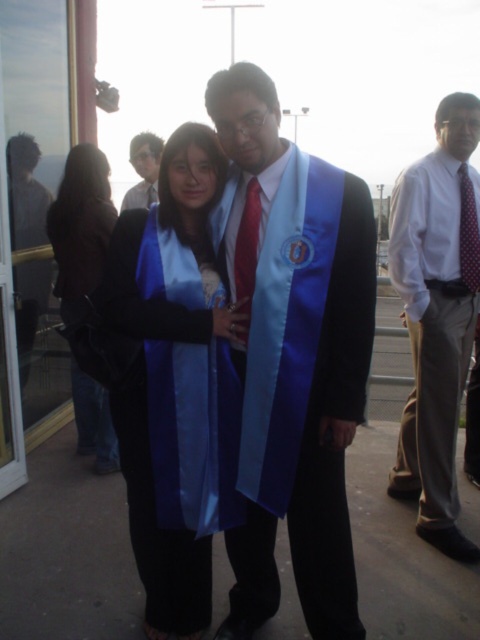
Question: Is the position of white shirt at center less distant than that of matte black tie at center?

Choices:
 (A) no
 (B) yes

Answer: (B)

Question: Which is farther from the blue satin sash at center?

Choices:
 (A) red satin tie at center
 (B) blue satin graduation gown at center
 (C) white shirt at center
 (D) polka dot silk tie at center

Answer: (D)

Question: Which point is closer to the camera taking this photo?

Choices:
 (A) (84, 401)
 (B) (404, 225)
 (C) (46, 275)
 (D) (144, 198)

Answer: (B)

Question: Can you confirm if satin blue sash at center is positioned to the left of matte black tie at center?

Choices:
 (A) yes
 (B) no

Answer: (B)

Question: Based on their relative distances, which object is nearer to the matte black tie at center?

Choices:
 (A) blue satin sash at center
 (B) red satin tie at center

Answer: (B)

Question: Is red satin tie at center closer to the viewer compared to polka dot silk tie at center?

Choices:
 (A) no
 (B) yes

Answer: (B)